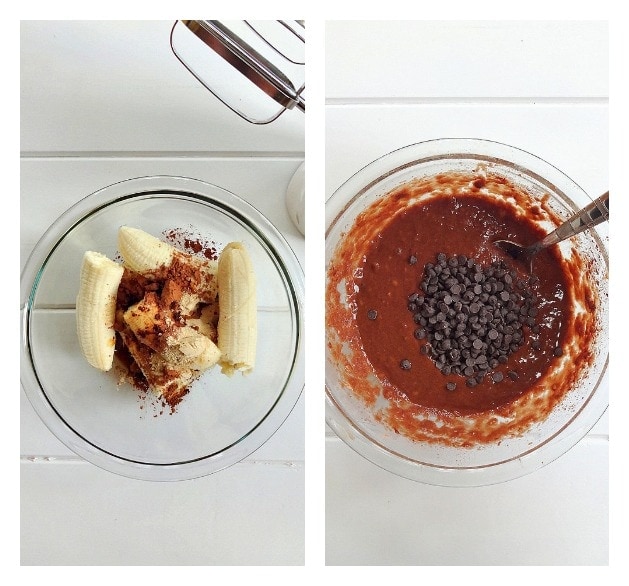
Identify the location of white surface. click(x=131, y=96), click(x=416, y=74).